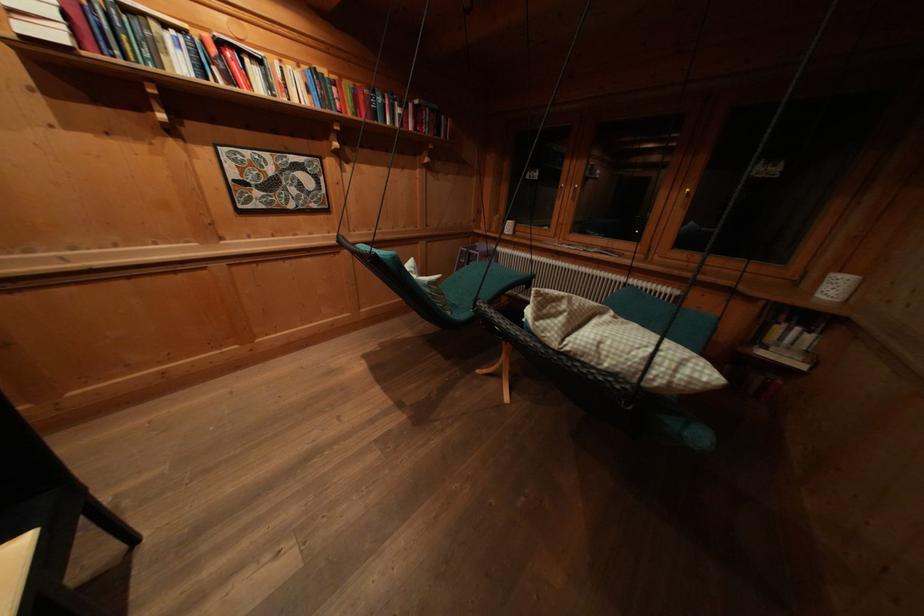
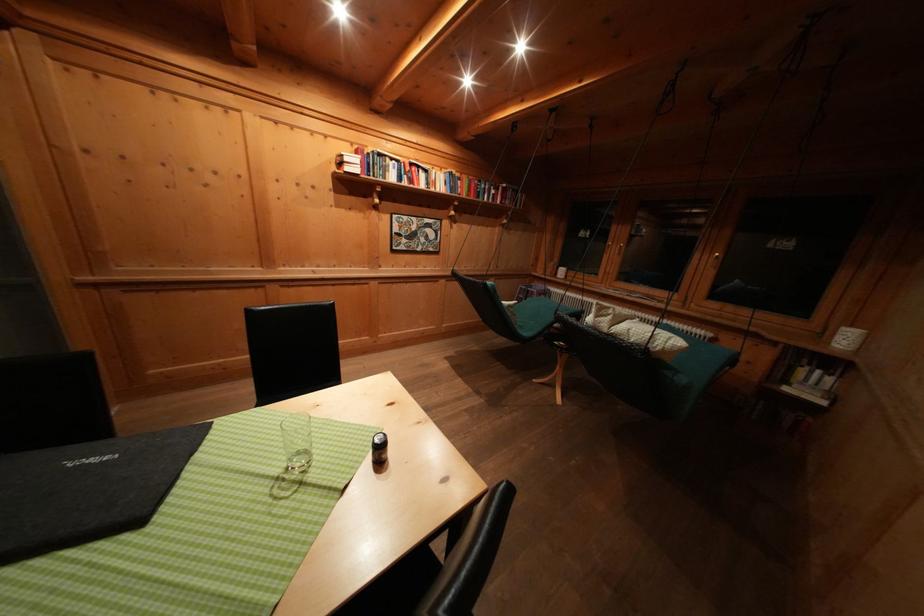
Question: The first image is from the beginning of the video and the second image is from the end. How did the camera likely rotate when shooting the video?

Choices:
 (A) Left
 (B) Right
 (C) Up
 (D) Down

Answer: (A)